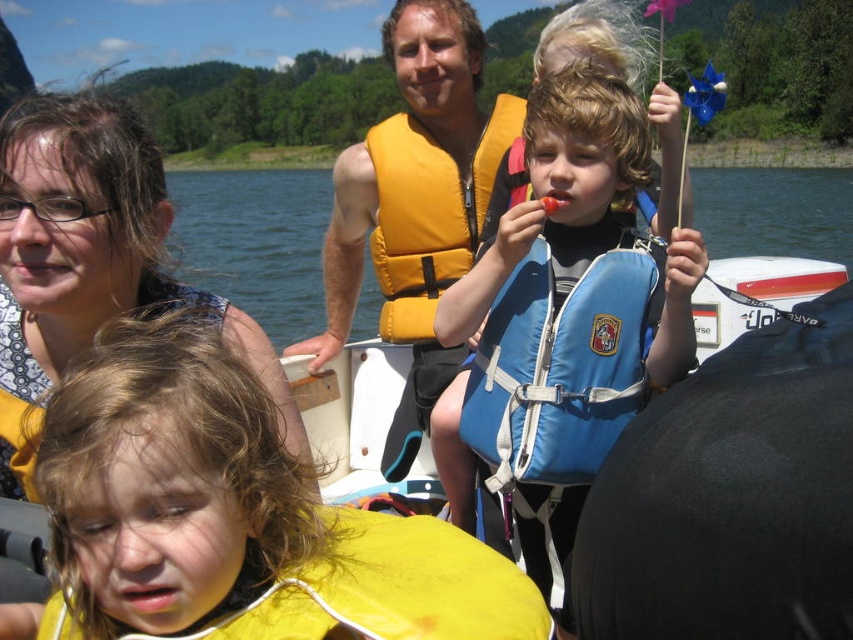
Question: Which point appears closest to the camera in this image?

Choices:
 (A) (450, 307)
 (B) (131, 307)
 (C) (74, 490)

Answer: (C)

Question: Does yellow life vest at lower left have a larger size compared to yellow fabric life jacket at center?

Choices:
 (A) yes
 (B) no

Answer: (B)

Question: Is matte black hair at upper left below yellow fabric life jacket at center?

Choices:
 (A) yes
 (B) no

Answer: (A)

Question: Which point is closer to the camera?

Choices:
 (A) matte black hair at upper left
 (B) blue life vest at center
 (C) yellow fabric life jacket at center
 (D) blue fabric life jacket at center

Answer: (A)

Question: Considering the relative positions of blue life vest at center and matte black hair at upper left in the image provided, where is blue life vest at center located with respect to matte black hair at upper left?

Choices:
 (A) above
 (B) below

Answer: (B)

Question: Which of the following is the farthest from the observer?

Choices:
 (A) (234, 632)
 (B) (546, 378)
 (C) (442, 164)

Answer: (C)